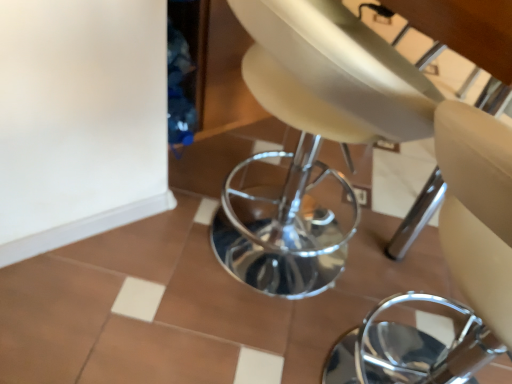
At what (x,y) coordinates should I click in order to perform the action: click on vacant space underneath beige leather chair at center (from a real-world perspective). Please return your answer as a coordinate pair (x, y). The image size is (512, 384). Looking at the image, I should click on (371, 347).